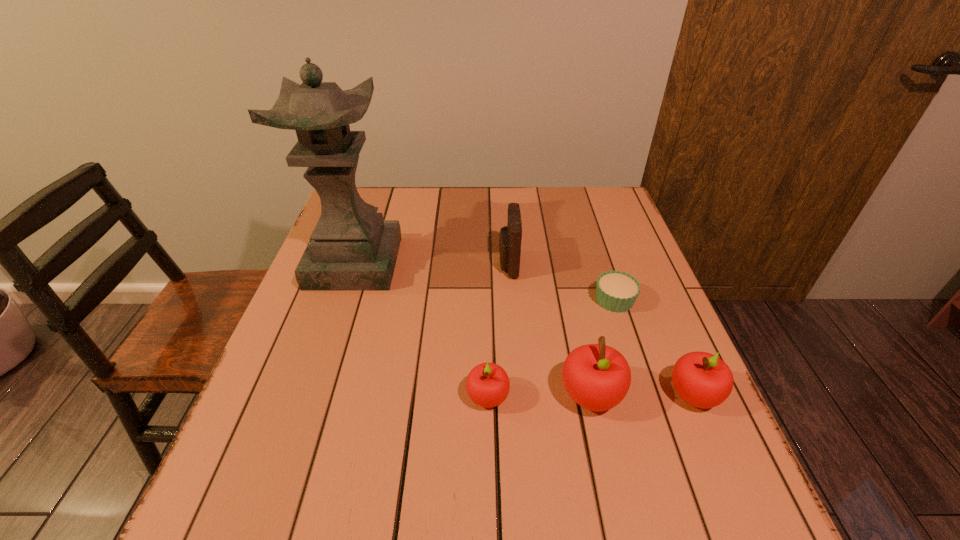
Identify the location of the leftmost apple. The image size is (960, 540). (487, 385).

Where is `the fifth tallest object`? the fifth tallest object is located at coordinates (487, 385).

Identify the location of the second apple from right to left. (597, 377).

I want to click on the fourth tallest object, so click(x=703, y=380).

Find the location of a particular element. Image resolution: width=960 pixels, height=540 pixels. the rightmost apple is located at coordinates pos(703,380).

Locate an element on the screen. This screenshot has height=540, width=960. the leftmost object is located at coordinates (351, 248).

The height and width of the screenshot is (540, 960). Find the location of `sculpture`. sculpture is located at coordinates (351, 248).

At what (x,y) coordinates should I click in order to perform the action: click on pouch. Please return your answer as a coordinate pair (x, y). This screenshot has width=960, height=540. Looking at the image, I should click on (510, 236).

Identify the location of the shortest object. This screenshot has width=960, height=540. (616, 291).

This screenshot has height=540, width=960. What are the coordinates of `free location located 0.190m on the right of the leftmost apple` in the screenshot? It's located at (605, 397).